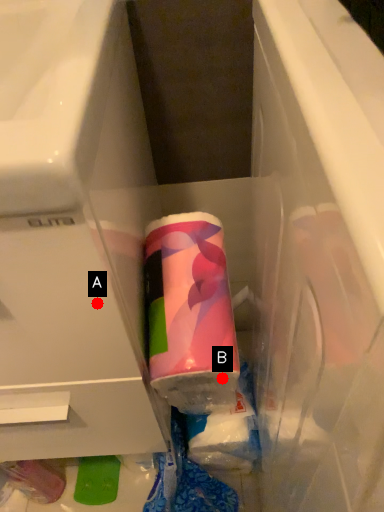
Question: Two points are circled on the image, labeled by A and B beside each circle. Which point is farther from the camera taking this photo?

Choices:
 (A) A is further
 (B) B is further

Answer: (B)